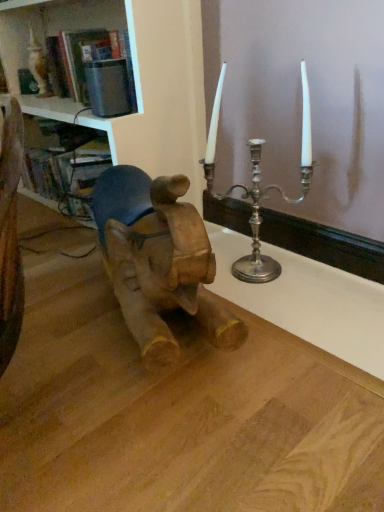
Question: Considering the positions of wooden baby elephant at left and wooden table at center in the image, is wooden baby elephant at left taller or shorter than wooden table at center?

Choices:
 (A) tall
 (B) short

Answer: (A)

Question: Considering the positions of wooden baby elephant at left and wooden table at center in the image, is wooden baby elephant at left wider or thinner than wooden table at center?

Choices:
 (A) wide
 (B) thin

Answer: (B)

Question: Which object is the farthest from the wooden table at center?

Choices:
 (A) wooden baby elephant at left
 (B) white glossy bookshelf at upper left

Answer: (B)

Question: Which object is positioned closest to the wooden baby elephant at left?

Choices:
 (A) wooden table at center
 (B) white glossy bookshelf at upper left

Answer: (A)